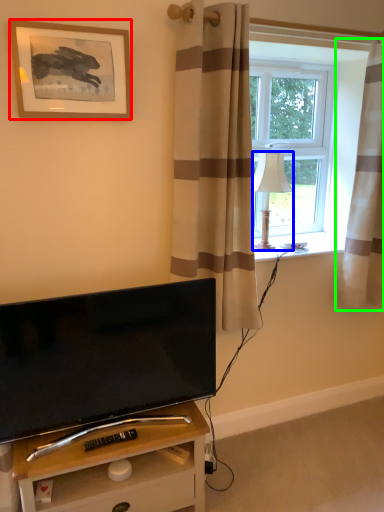
Question: Which object is positioned closest to picture frame (highlighted by a red box)? Select from lamp (highlighted by a blue box) and curtain (highlighted by a green box).

Choices:
 (A) lamp
 (B) curtain

Answer: (A)